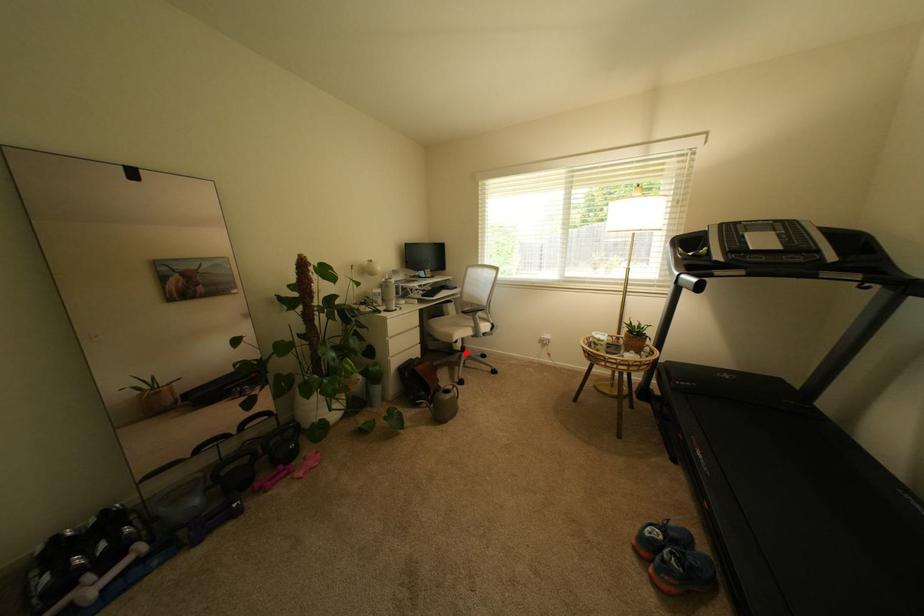
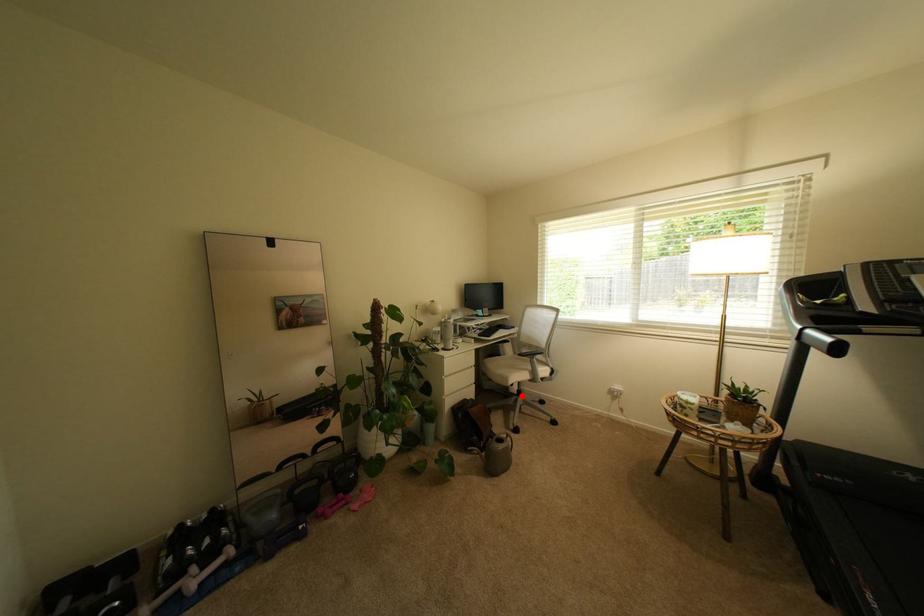
I am providing you with two images of the same scene from different viewpoints. A red point is marked on the first image and another point is marked on the second image. Is the marked point in image1 the same physical position as the marked point in image2?

Yes